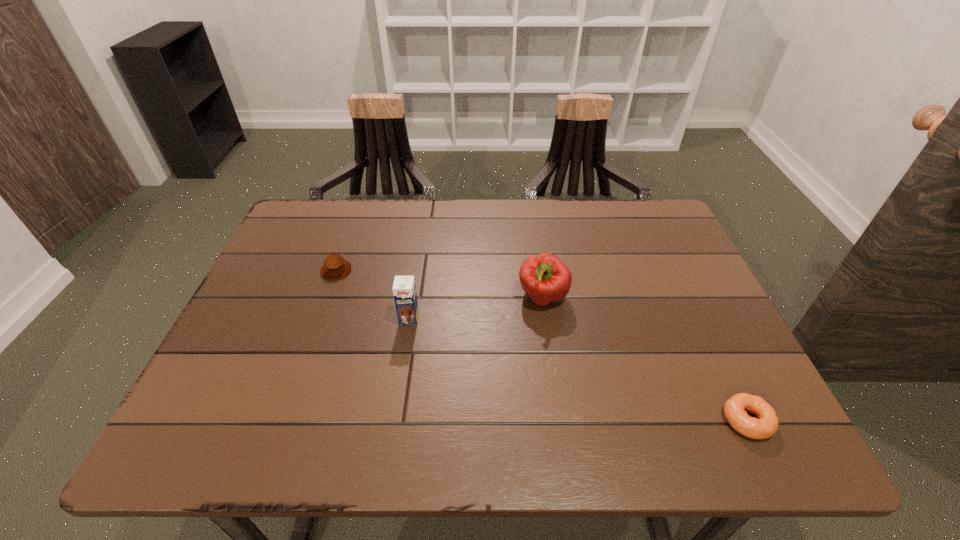
Identify which object is located as the second nearest to the shortest object. Please provide its 2D coordinates. Your answer should be formatted as a tuple, i.e. [(x, y)], where the tuple contains the x and y coordinates of a point satisfying the conditions above.

[(404, 290)]

Locate an element on the screen. This screenshot has height=540, width=960. free space that satisfies the following two spatial constraints: 1. on the front side of the bell pepper; 2. on the left side of the shortest object is located at coordinates (561, 420).

You are a GUI agent. You are given a task and a screenshot of the screen. Output one action in this format:
    pyautogui.click(x=<x>, y=<y>)
    Task: Click on the vacant space that satisfies the following two spatial constraints: 1. on the front side of the nearest object; 2. on the left side of the bell pepper
    
    Given the screenshot: What is the action you would take?
    pyautogui.click(x=561, y=420)

Find the location of a particular element. Image resolution: width=960 pixels, height=540 pixels. vacant space that satisfies the following two spatial constraints: 1. on the front label of the chocolate milk; 2. on the left side of the shortest object is located at coordinates (394, 420).

You are a GUI agent. You are given a task and a screenshot of the screen. Output one action in this format:
    pyautogui.click(x=<x>, y=<y>)
    Task: Click on the vacant area that satisfies the following two spatial constraints: 1. on the front side of the rightmost object; 2. on the right side of the leftmost object
    This screenshot has height=540, width=960.
    Given the screenshot: What is the action you would take?
    pyautogui.click(x=283, y=420)